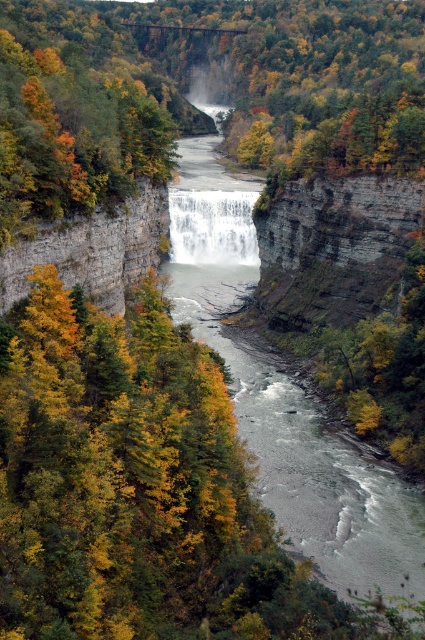
Is point (308, 522) positioned before point (84, 275)?

That is True.

Is gray smooth river at center positioned before rustic stone cliff at left?

That is True.

Between point (280, 390) and point (141, 186), which one is positioned behind?

Positioned behind is point (141, 186).

This screenshot has width=425, height=640. Identify the location of gray smooth river at center. (285, 397).

Which is in front, point (354, 564) or point (130, 134)?

Point (354, 564) is in front.

Between point (280, 419) and point (27, 42), which one is positioned behind?

Positioned behind is point (27, 42).

The height and width of the screenshot is (640, 425). I want to click on gray smooth river at center, so click(285, 397).

The width and height of the screenshot is (425, 640). What are the coordinates of `gray smooth river at center` in the screenshot? It's located at (285, 397).

Which of these two, autumn leaves at center or white textured water at center, stands shorter?

white textured water at center

Is autumn leaves at center taller than white textured water at center?

Indeed, autumn leaves at center has a greater height compared to white textured water at center.

Which is behind, point (45, 42) or point (215, 209)?

The point (215, 209) is behind.

Identify the location of autumn leaves at center. The width and height of the screenshot is (425, 640). (70, 116).